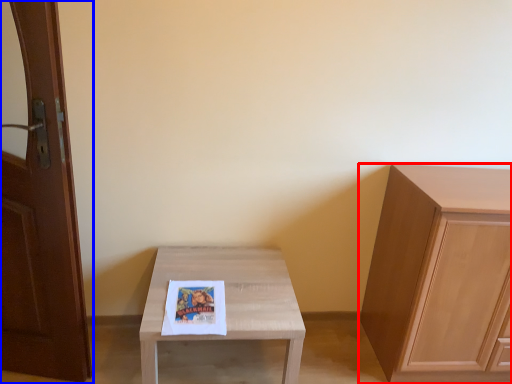
Question: Which point is further to the camera, cabinetry (highlighted by a red box) or door (highlighted by a blue box)?

Choices:
 (A) cabinetry
 (B) door

Answer: (A)